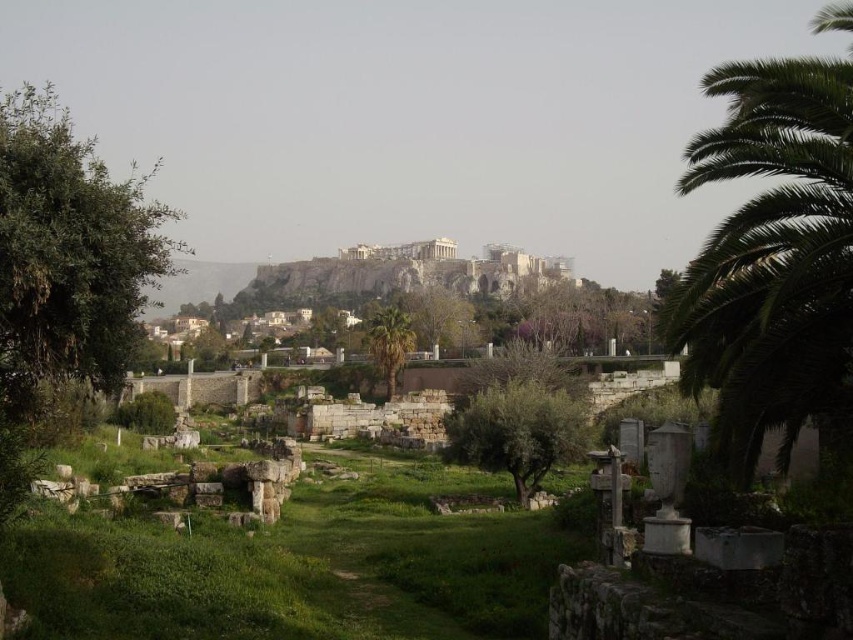
Can you confirm if green leafy palm at right is bigger than green leafy tree at left?

No, green leafy palm at right is not bigger than green leafy tree at left.

Is green leafy palm at right shorter than green leafy tree at left?

Yes, green leafy palm at right is shorter than green leafy tree at left.

At what (x,y) coordinates should I click in order to perform the action: click on green leafy palm at right. Please return your answer as a coordinate pair (x, y). This screenshot has height=640, width=853. Looking at the image, I should click on (772, 259).

Is point (532, 532) more distant than point (523, 420)?

No, it is in front of (523, 420).

Which is more to the left, green grass at center or green leafy tree at center?

Positioned to the left is green grass at center.

Is point (293, 488) positioned behind point (570, 404)?

Yes, point (293, 488) is farther from viewer.

The height and width of the screenshot is (640, 853). I want to click on green grass at center, so click(294, 568).

Who is more distant from viewer, (136, 547) or (383, 314)?

The point (383, 314) is behind.

Between point (204, 586) and point (395, 324), which one is positioned in front?

Positioned in front is point (204, 586).

Locate an element on the screen. green grass at center is located at coordinates (294, 568).